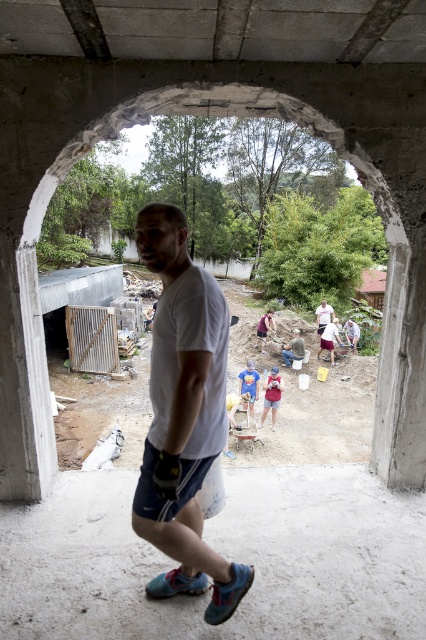
Can you confirm if concrete at center is positioned above blue denim shorts at center?

Yes.

Does point (39, 312) come behind point (284, 349)?

No, it is in front of (284, 349).

The image size is (426, 640). What do you see at coordinates (224, 113) in the screenshot?
I see `concrete at center` at bounding box center [224, 113].

Locate an element on the screen. concrete at center is located at coordinates (224, 113).

Based on the photo, which is more to the right, concrete at center or white matte t-shirt at center?

concrete at center

Can you confirm if concrete at center is positioned above white matte t-shirt at center?

Indeed, concrete at center is positioned over white matte t-shirt at center.

Is point (391, 257) more distant than point (135, 236)?

No, (391, 257) is closer to viewer.

Where is `concrete at center`? concrete at center is located at coordinates (224, 113).

Is white matte t-shirt at center behind blue denim shorts at center?

No, it is not.

Can you confirm if white matte t-shirt at center is positioned to the right of blue denim shorts at center?

In fact, white matte t-shirt at center is to the left of blue denim shorts at center.

Is point (154, 396) in front of point (294, 339)?

That is True.

This screenshot has width=426, height=640. Find the location of `white matte t-shirt at center`. white matte t-shirt at center is located at coordinates (184, 417).